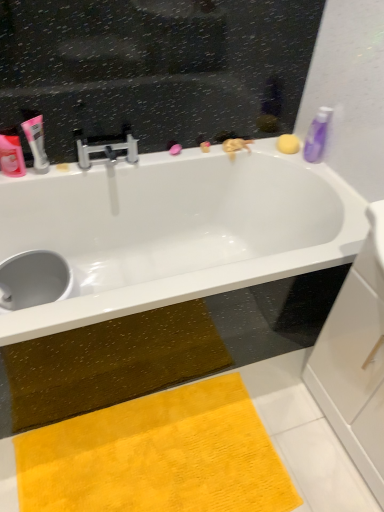
Question: Considering the positions of pink matte tube at upper left, which appears as the 2th toiletry when viewed from the right, and yellow sponge at upper right in the image, is pink matte tube at upper left, which appears as the 2th toiletry when viewed from the right, bigger or smaller than yellow sponge at upper right?

Choices:
 (A) big
 (B) small

Answer: (A)

Question: In terms of width, does pink matte tube at upper left, marked as the 2th toiletry in a left-to-right arrangement, look wider or thinner when compared to yellow sponge at upper right?

Choices:
 (A) wide
 (B) thin

Answer: (B)

Question: Which is farther from the silver metallic faucet at upper center?

Choices:
 (A) yellow plush doormat at lower center
 (B) purple glossy bottle at upper right, the third toiletry viewed from the left
 (C) white glossy bathtub at upper center
 (D) matte pink tube at left, which ranks as the third toiletry in right-to-left order
 (E) yellow sponge at upper right

Answer: (A)

Question: Estimate the real-world distances between objects in this image. Which object is closer to the yellow plush doormat at lower center?

Choices:
 (A) silver metallic faucet at upper center
 (B) yellow sponge at upper right
 (C) matte pink tube at left, which is the 1th toiletry from left to right
 (D) purple glossy bottle at upper right, the third toiletry viewed from the left
 (E) pink matte tube at upper left, marked as the 2th toiletry in a left-to-right arrangement

Answer: (A)